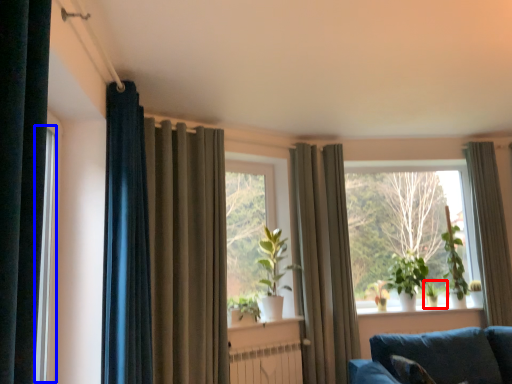
Question: Which object is further to the camera taking this photo, plant (highlighted by a red box) or window frame (highlighted by a blue box)?

Choices:
 (A) plant
 (B) window frame

Answer: (A)